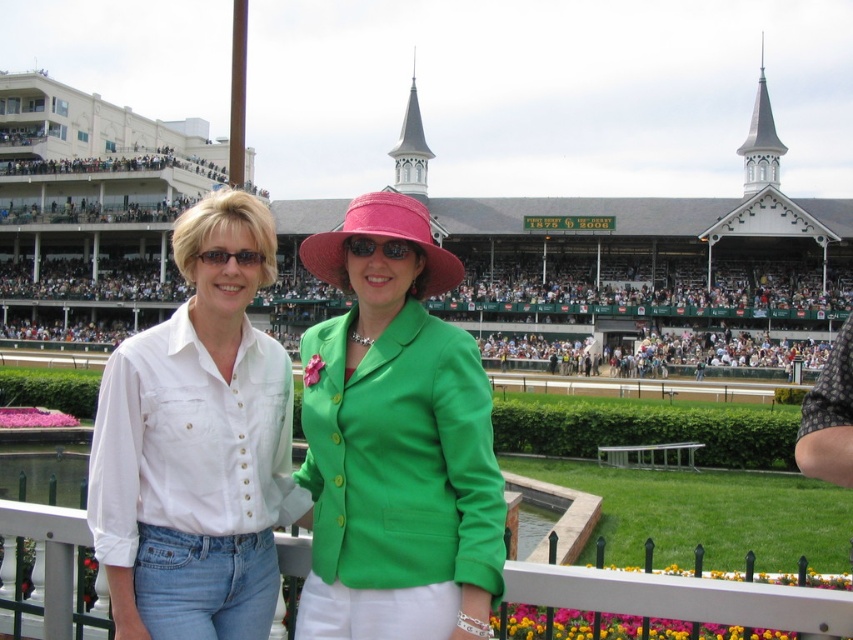
You are a photographer trying to capture a clear shot of the two women without any obstructions. Given that the white plastic fence at center and the matte black sunglasses at center are in the frame, which object would you need to adjust your angle to avoid?

The white plastic fence at center is bigger than the matte black sunglasses at center, so you would need to adjust your angle to avoid the white plastic fence at center as it is larger and more likely to obstruct the shot.

You are a photographer at the horse racing event. You want to take a photo of the two women standing at point (x=461, y=378). The minimum distance required for your camera to focus properly is 100 feet. Will the camera be able to focus on them?

The two women are 120.49 feet apart, which is more than the minimum required 100 feet for the camera to focus properly. Therefore, the camera should be able to focus on them.